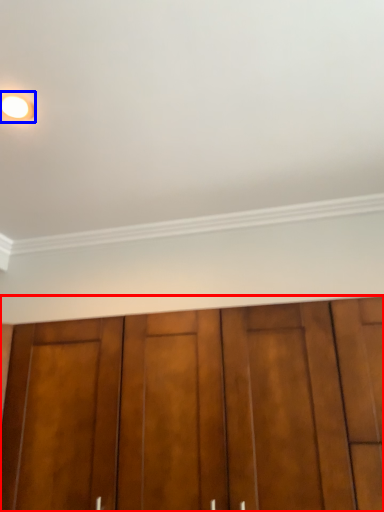
Question: Which of the following is the closest to the observer, door (highlighted by a red box) or lighting (highlighted by a blue box)?

Choices:
 (A) door
 (B) lighting

Answer: (A)